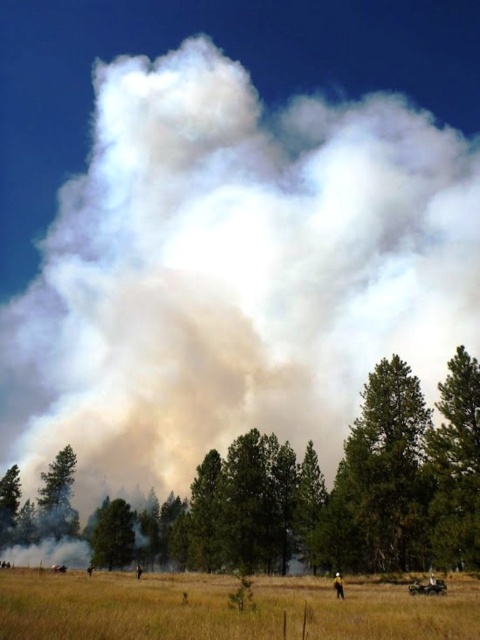
Question: Which is farther from the green textured tree at right?

Choices:
 (A) green matte tree at lower center
 (B) dry grass at lower center
 (C) green matte tree at lower left

Answer: (C)

Question: Can you confirm if dry grass at lower center is positioned below green matte tree at lower left?

Choices:
 (A) yes
 (B) no

Answer: (B)

Question: Which point is farther to the camera?

Choices:
 (A) green leafy tree at center
 (B) green matte tree at lower left

Answer: (B)

Question: Is green matte tree at lower left positioned in front of green matte tree at lower center?

Choices:
 (A) yes
 (B) no

Answer: (B)

Question: Which of the following is the closest to the observer?

Choices:
 (A) (110, 536)
 (B) (71, 518)
 (C) (252, 616)
 (D) (248, 561)

Answer: (C)

Question: Is green matte tree at lower left to the right of green matte tree at lower center from the viewer's perspective?

Choices:
 (A) yes
 (B) no

Answer: (B)